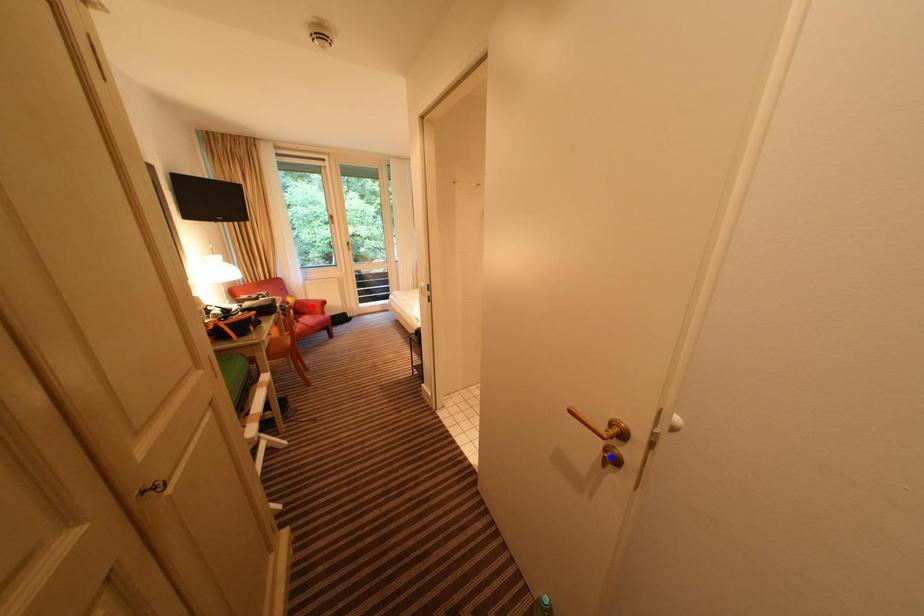
Question: Two points are marked on the image. Which point is closer to the camera?

Choices:
 (A) Blue point is closer.
 (B) Red point is closer.

Answer: (A)